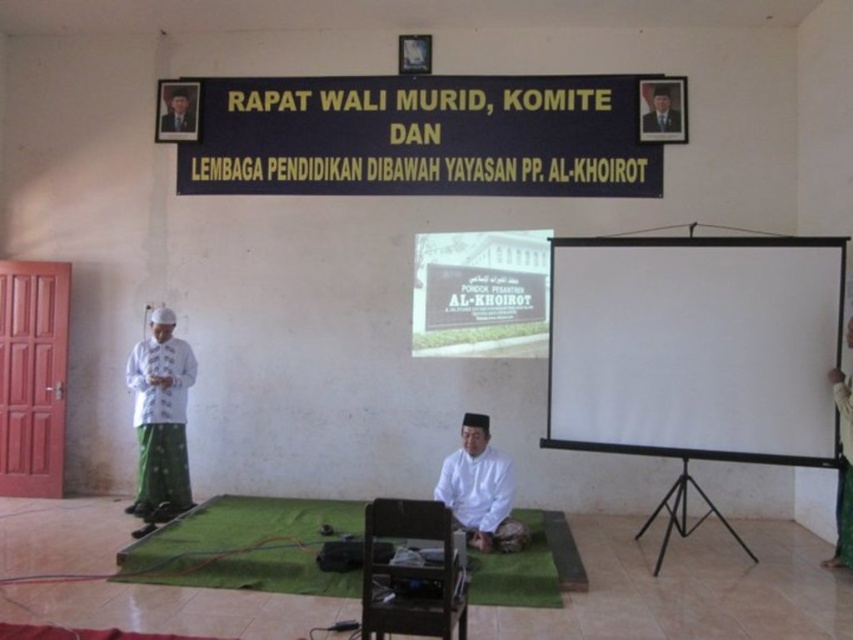
Is green carpet at center thinner than white matte shirt at center?

No.

Does green carpet at center appear over white matte shirt at center?

No, green carpet at center is not above white matte shirt at center.

Is point (184, 540) closer to viewer compared to point (495, 490)?

Yes, it is in front of point (495, 490).

Identify the location of green carpet at center. The height and width of the screenshot is (640, 853). (242, 525).

Is point (631, 156) closer to camera compared to point (657, 109)?

No, (631, 156) is further to viewer.

Is black plastic signboard at upper center to the right of formal suit at upper right from the viewer's perspective?

No, black plastic signboard at upper center is not to the right of formal suit at upper right.

Does point (535, 93) come behind point (669, 93)?

Yes, it is.

Locate an element on the screen. The height and width of the screenshot is (640, 853). black plastic signboard at upper center is located at coordinates (421, 136).

Does white cotton shirt at left appear on the left side of green fabric at right?

Yes, white cotton shirt at left is to the left of green fabric at right.

This screenshot has height=640, width=853. Identify the location of white cotton shirt at left. (160, 420).